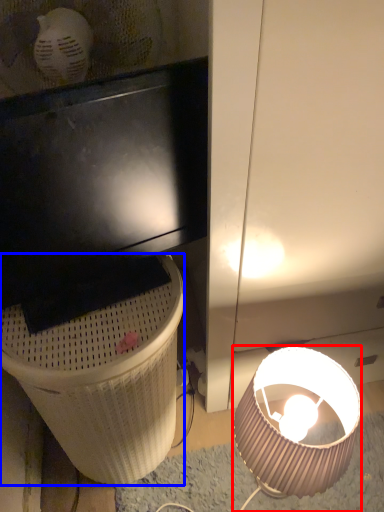
Question: Among these objects, which one is farthest to the camera, lamp (highlighted by a red box) or trash bin/can (highlighted by a blue box)?

Choices:
 (A) lamp
 (B) trash bin/can

Answer: (A)